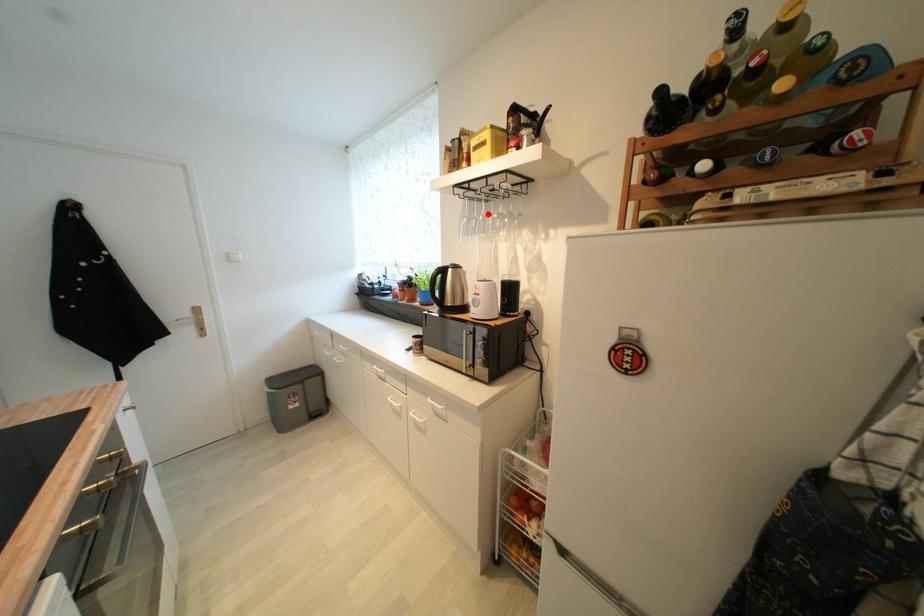
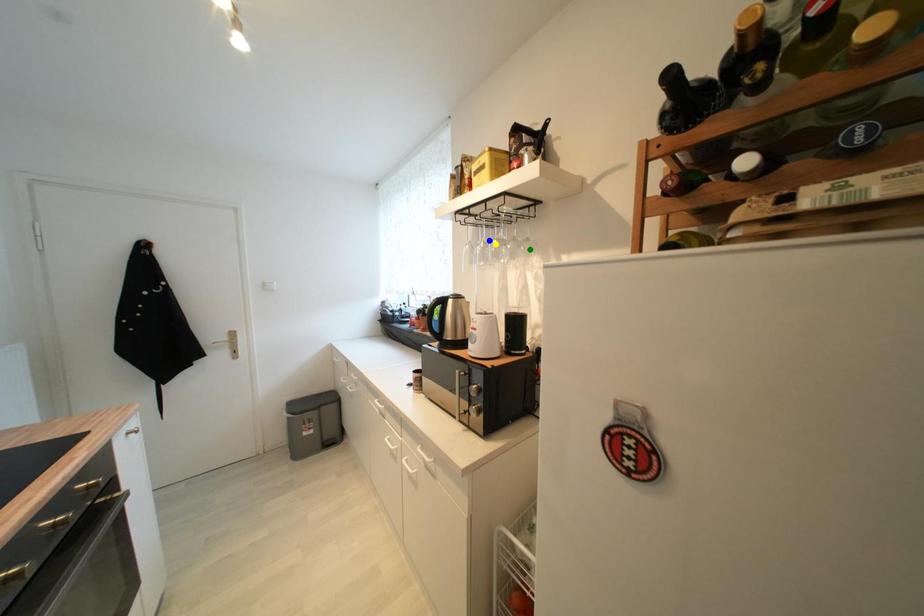
Question: I am providing you with two images of the same scene from different viewpoints. A red point is marked on the first image. You are given multiple points on the second image. Which point in image 2 represents the same 3d spot as the red point in image 1?

Choices:
 (A) green point
 (B) blue point
 (C) yellow point

Answer: (B)